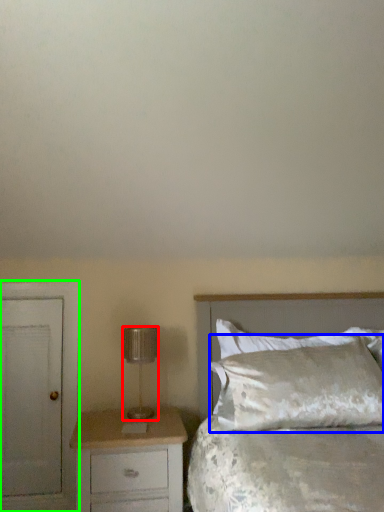
Question: Which object is the farthest from lamp (highlighted by a red box)? Choose among these: pillow (highlighted by a blue box) or armoire (highlighted by a green box).

Choices:
 (A) pillow
 (B) armoire

Answer: (A)